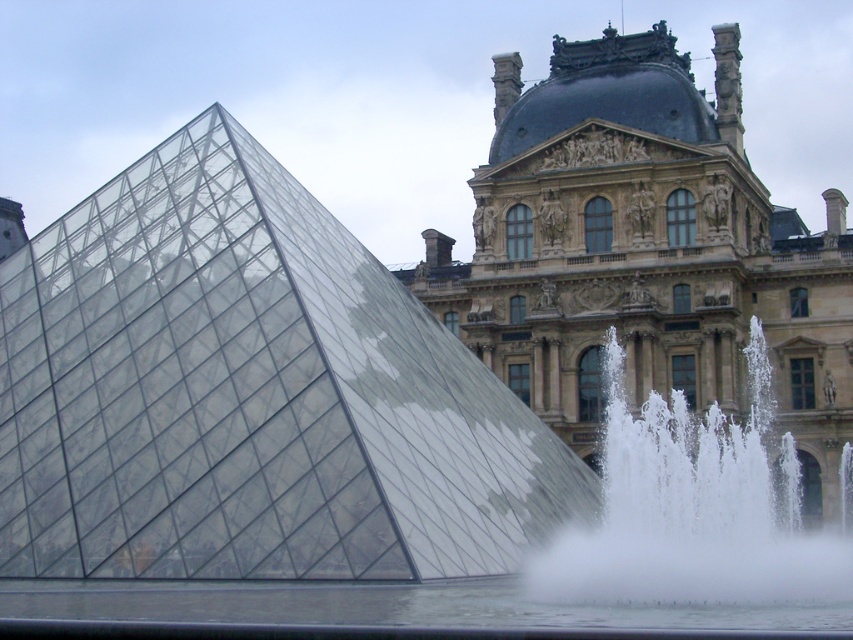
Measure the distance between transparent glass pyramid at center and camera.

transparent glass pyramid at center is 62.61 meters away from camera.

Which is more to the left, transparent glass pyramid at center or white frothy water at lower right?

transparent glass pyramid at center

Describe the element at coordinates (248, 394) in the screenshot. I see `transparent glass pyramid at center` at that location.

Where is `transparent glass pyramid at center`? Image resolution: width=853 pixels, height=640 pixels. transparent glass pyramid at center is located at coordinates (248, 394).

Can you confirm if golden stone palace at upper center is thinner than white frothy water at lower right?

In fact, golden stone palace at upper center might be wider than white frothy water at lower right.

Can you confirm if golden stone palace at upper center is bigger than white frothy water at lower right?

Yes, golden stone palace at upper center is bigger than white frothy water at lower right.

Identify the location of golden stone palace at upper center. (643, 250).

Where is `golden stone palace at upper center`? The image size is (853, 640). golden stone palace at upper center is located at coordinates (643, 250).

Who is positioned more to the right, transparent glass pyramid at center or golden stone palace at upper center?

golden stone palace at upper center is more to the right.

Between transparent glass pyramid at center and golden stone palace at upper center, which one is positioned lower?

transparent glass pyramid at center is below.

Measure the distance between point (44,362) and camera.

The distance of point (44,362) from camera is 250.97 feet.

Image resolution: width=853 pixels, height=640 pixels. Identify the location of transparent glass pyramid at center. (248, 394).